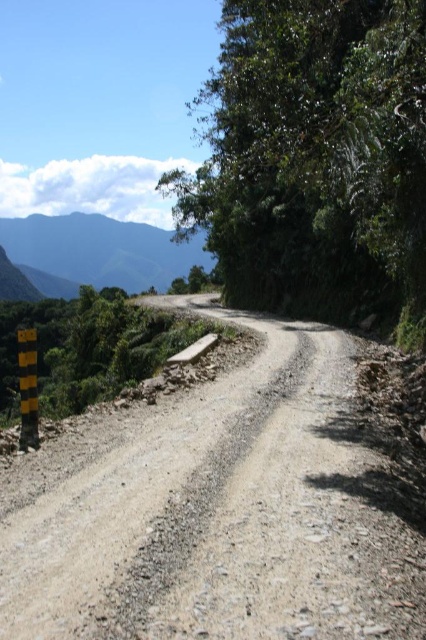
Question: Is gray gravel road at center positioned in front of green leafy tree at upper right?

Choices:
 (A) no
 (B) yes

Answer: (B)

Question: Where is gray gravel road at center located in relation to green textured mountain at upper left in the image?

Choices:
 (A) right
 (B) left

Answer: (A)

Question: Estimate the real-world distances between objects in this image. Which object is closer to the gray gravel road at center?

Choices:
 (A) green leafy tree at upper right
 (B) green textured mountain at upper left

Answer: (A)

Question: Estimate the real-world distances between objects in this image. Which object is farther from the green textured mountain at upper left?

Choices:
 (A) gray gravel road at center
 (B) green leafy tree at upper right

Answer: (A)

Question: Which point is closer to the camera taking this photo?

Choices:
 (A) (115, 227)
 (B) (226, 125)

Answer: (B)

Question: Can you confirm if green leafy tree at upper right is positioned below green textured mountain at upper left?

Choices:
 (A) yes
 (B) no

Answer: (B)